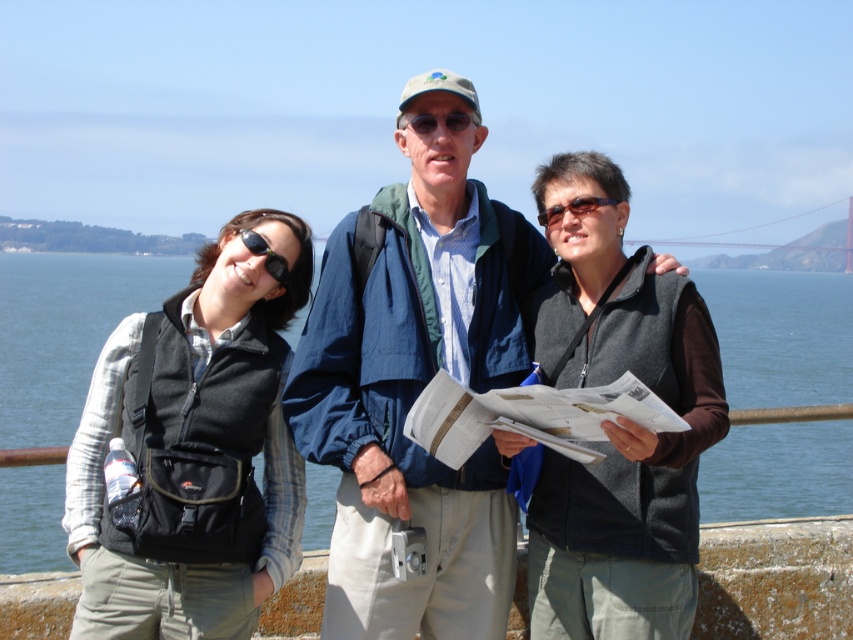
Question: Which point is closer to the camera taking this photo?

Choices:
 (A) (49, 301)
 (B) (718, 392)

Answer: (B)

Question: Is matte black vest at center thinner than black fleece vest at left?

Choices:
 (A) yes
 (B) no

Answer: (B)

Question: Which point appears farthest from the camera in this image?

Choices:
 (A) (517, 280)
 (B) (527, 248)

Answer: (B)

Question: Is blue fabric jacket at center closer to camera compared to black fleece vest at left?

Choices:
 (A) no
 (B) yes

Answer: (A)

Question: Is matte black vest at center to the right of black fleece vest at left from the viewer's perspective?

Choices:
 (A) yes
 (B) no

Answer: (A)

Question: Which point appears closest to the camera in this image?

Choices:
 (A) (593, 541)
 (B) (361, 584)
 (C) (456, 502)
 (D) (706, 269)

Answer: (A)